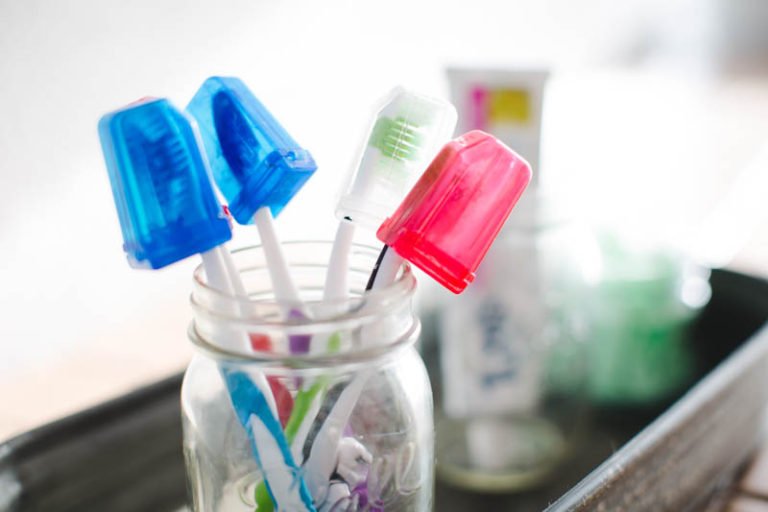
Identify the location of blue toothbrush. (245, 395).